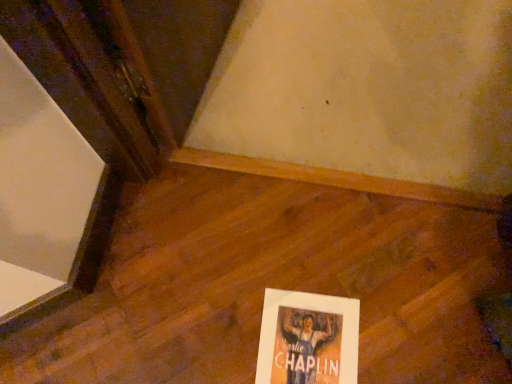
The image size is (512, 384). What are the coordinates of `free space to the left of matte paper poster at lower right` in the screenshot? It's located at (206, 331).